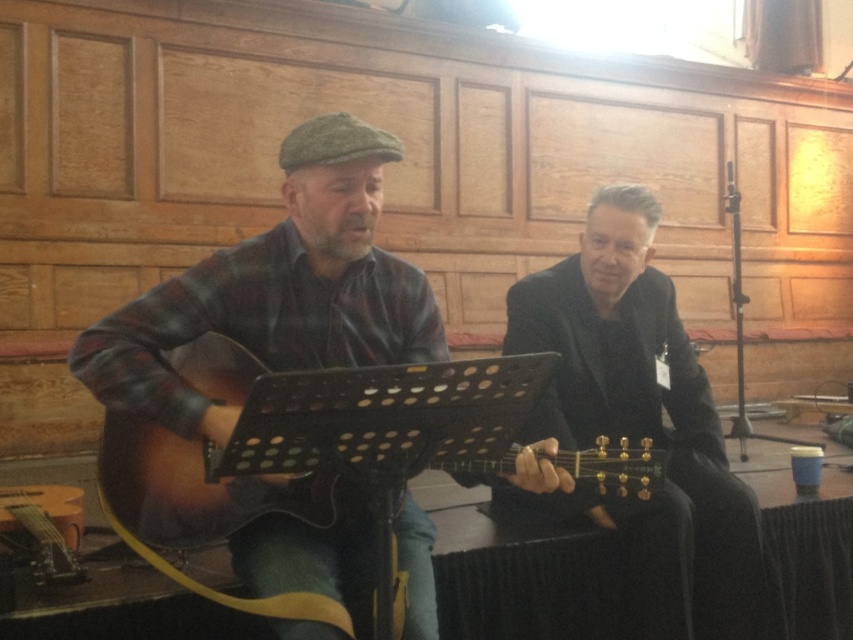
Where is `matte plaid shirt at center`? matte plaid shirt at center is located at coordinates (277, 291).

Measure the distance between matte plaid shirt at center and black glossy suit at center.

28.97 inches

Between point (299, 362) and point (676, 410), which one is positioned behind?

The point (676, 410) is more distant.

Where is `matte plaid shirt at center`? matte plaid shirt at center is located at coordinates (277, 291).

Is matte plaid shirt at center wider than sunburst wood guitar at center?

No.

Which is more to the left, matte plaid shirt at center or sunburst wood guitar at center?

matte plaid shirt at center

The height and width of the screenshot is (640, 853). I want to click on matte plaid shirt at center, so click(277, 291).

Consider the image. Does black glossy suit at center appear on the left side of sunburst wood guitar at center?

No, black glossy suit at center is not to the left of sunburst wood guitar at center.

In order to click on black glossy suit at center in this screenshot , I will do `click(645, 420)`.

Locate an element on the screen. black glossy suit at center is located at coordinates (645, 420).